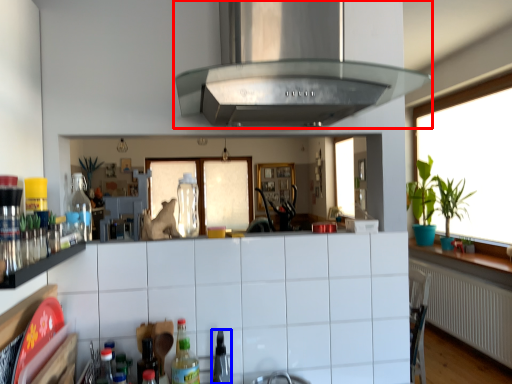
Question: Which point is closer to the camera, exhaust hood (highlighted by a red box) or appliance (highlighted by a blue box)?

Choices:
 (A) exhaust hood
 (B) appliance

Answer: (A)